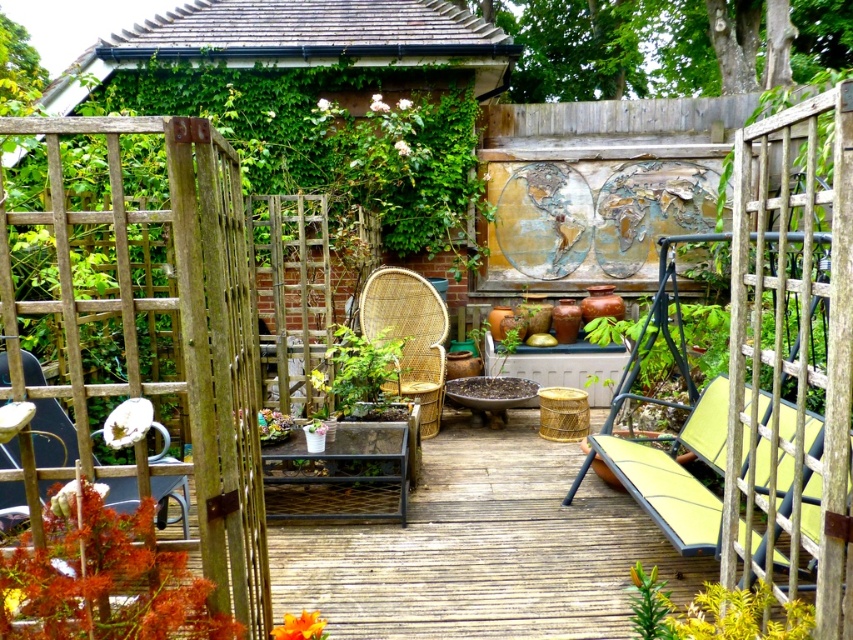
You are planning to place a small table between the wooden deck at center and the woven rattan chair at center. The table requires 30 inches of space. Is there enough space between them to accommodate the table?

The wooden deck at center and woven rattan chair at center are 33.24 inches apart, which is more than the required 30 inches. Therefore, there is enough space to place the small table between them.